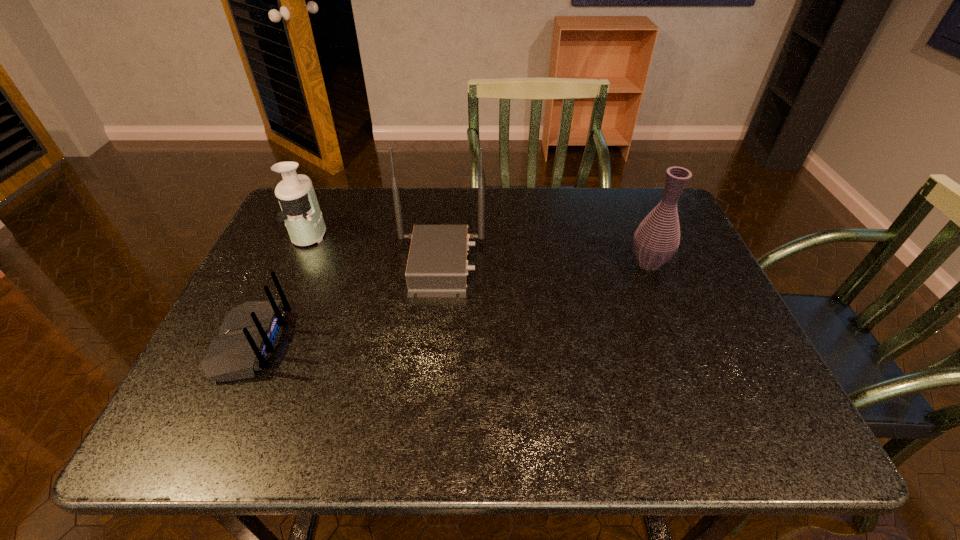
You are a GUI agent. You are given a task and a screenshot of the screen. Output one action in this format:
    pyautogui.click(x=<x>, y=<y>)
    Task: Click on the right router
    
    Given the screenshot: What is the action you would take?
    pyautogui.click(x=437, y=267)

Identify the location of the taller router. (437, 267).

At what (x,y) coordinates should I click in order to perform the action: click on the rightmost object. Please return your answer as a coordinate pair (x, y). Image resolution: width=960 pixels, height=540 pixels. Looking at the image, I should click on (656, 240).

Where is `the second shortest object`? The image size is (960, 540). the second shortest object is located at coordinates (301, 213).

Locate an element on the screen. Image resolution: width=960 pixels, height=540 pixels. the left router is located at coordinates (248, 336).

At what (x,y) coordinates should I click in order to perform the action: click on the shorter router. Please return your answer as a coordinate pair (x, y). This screenshot has width=960, height=540. Looking at the image, I should click on (248, 336).

What are the coordinates of `free space located on the back of the taller router to connect cables` in the screenshot? It's located at (538, 264).

The height and width of the screenshot is (540, 960). Find the location of `vacant space positioned 0.150m on the back of the rightmost object`. vacant space positioned 0.150m on the back of the rightmost object is located at coordinates (630, 217).

You are a GUI agent. You are given a task and a screenshot of the screen. Output one action in this format:
    pyautogui.click(x=<x>, y=<y>)
    Task: Click on the vacant region located on the left of the second shortest object
    
    Given the screenshot: What is the action you would take?
    pyautogui.click(x=276, y=233)

I want to click on blank area located 0.170m on the back of the nearer router, so click(x=359, y=343).